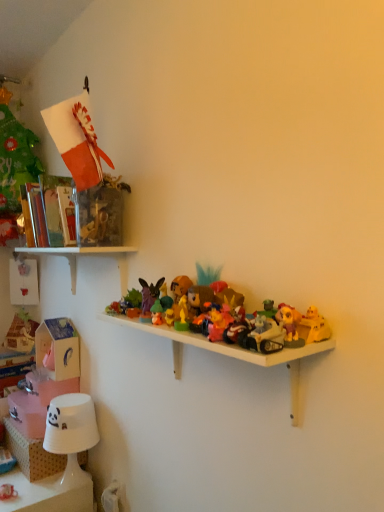
The width and height of the screenshot is (384, 512). Identify the location of green matte figurine at center, placed as the fourth toy when sorted from front to back. (157, 313).

Describe the element at coordinates (180, 286) in the screenshot. This screenshot has height=512, width=384. I see `shiny plastic figure at center, the fourth toy viewed from the left` at that location.

What is the approximate width of white plastic shelf at upper left, which appears as the 1th shelf when viewed from the top?

white plastic shelf at upper left, which appears as the 1th shelf when viewed from the top, is 8.12 inches wide.

The height and width of the screenshot is (512, 384). Find the location of `white glossy lampshade at lower left, the 3th shelf in the top-to-bottom sequence`. white glossy lampshade at lower left, the 3th shelf in the top-to-bottom sequence is located at coordinates (31, 454).

What's the angular difference between white glossy lampshade at lower left, the 3th shelf in the top-to-bottom sequence, and purple matte plush toy at center, placed as the second toy when sorted from left to right,'s facing directions?

They differ by 35.3 degrees in their facing directions.

Locate an element on the screen. toy that is the 1st one when counting rightward from the white glossy lampshade at lower left, the 3th shelf in the top-to-bottom sequence is located at coordinates (149, 294).

From a real-world perspective, is white glossy lampshade at lower left, positioned as the first shelf in bottom-to-top order, located beneath purple matte plush toy at center, arranged as the seventh toy when viewed from the right?

Yes, from a real-world perspective, white glossy lampshade at lower left, positioned as the first shelf in bottom-to-top order, is below purple matte plush toy at center, arranged as the seventh toy when viewed from the right.

Does white glossy lampshade at lower left, positioned as the first shelf in bottom-to-top order, have a smaller size compared to purple matte plush toy at center, which is the third toy from top to bottom?

No.

Consider the image. Can you tell me how much matte plastic toy at center, placed as the eighth toy when sorted from bottom to top, and white plastic shelf at center, the 2th shelf positioned from the top, differ in facing direction?

They differ by 0.00247 degrees in their facing directions.

From the image's perspective, is matte plastic toy at center, the fifth toy viewed from the left, above white plastic shelf at center, which is counted as the 2th shelf, starting from the bottom?

Indeed, from the image's perspective, matte plastic toy at center, the fifth toy viewed from the left, is shown above white plastic shelf at center, which is counted as the 2th shelf, starting from the bottom.

Can you confirm if matte plastic toy at center, the fourth toy in the right-to-left sequence, is taller than white plastic shelf at center, the 2th shelf positioned from the top?

Incorrect, the height of matte plastic toy at center, the fourth toy in the right-to-left sequence, is not larger of that of white plastic shelf at center, the 2th shelf positioned from the top.

From a real-world perspective, which is physically above, shiny plastic motorcycle at center, which is the 8th toy in back-to-front order, or white plastic shelf at upper left, which appears as the 1th shelf when viewed from the top?

From a 3D spatial view, white plastic shelf at upper left, which appears as the 1th shelf when viewed from the top, is above.

From the image's perspective, is shiny plastic motorcycle at center, marked as the seventh toy in a left-to-right arrangement, above or below white plastic shelf at upper left, marked as the 3th shelf in a bottom-to-top arrangement?

shiny plastic motorcycle at center, marked as the seventh toy in a left-to-right arrangement, is below white plastic shelf at upper left, marked as the 3th shelf in a bottom-to-top arrangement.

Is shiny plastic motorcycle at center, marked as the seventh toy in a left-to-right arrangement, located outside white plastic shelf at upper left, which appears as the 1th shelf when viewed from the top?

Yes, shiny plastic motorcycle at center, marked as the seventh toy in a left-to-right arrangement, is outside of white plastic shelf at upper left, which appears as the 1th shelf when viewed from the top.

Between white plastic shelf at center, which is counted as the 2th shelf, starting from the bottom, and matte plastic toy at center, the fourth toy in the right-to-left sequence, which one has less height?

With less height is matte plastic toy at center, the fourth toy in the right-to-left sequence.

Which object is thinner, white plastic shelf at center, the 2th shelf positioned from the top, or matte plastic toy at center, the fifth toy viewed from the left?

matte plastic toy at center, the fifth toy viewed from the left, is thinner.

From the image's perspective, is white plastic shelf at center, which is counted as the 2th shelf, starting from the bottom, positioned above or below matte plastic toy at center, arranged as the fourth toy when viewed from the back?

Clearly, from the image's perspective, white plastic shelf at center, which is counted as the 2th shelf, starting from the bottom, is below matte plastic toy at center, arranged as the fourth toy when viewed from the back.

Where is `the 7th toy located above the white plastic shelf at center, which is counted as the 2th shelf, starting from the bottom (from a real-world perspective)`? The image size is (384, 512). the 7th toy located above the white plastic shelf at center, which is counted as the 2th shelf, starting from the bottom (from a real-world perspective) is located at coordinates point(199,298).

Which object is wider, white plastic shelf at center, which is counted as the 2th shelf, starting from the bottom, or white plastic shelf at upper left, which appears as the 1th shelf when viewed from the top?

white plastic shelf at upper left, which appears as the 1th shelf when viewed from the top.

In the scene shown: Between white plastic shelf at center, the 2th shelf positioned from the top, and white plastic shelf at upper left, which appears as the 1th shelf when viewed from the top, which one appears on the right side from the viewer's perspective?

Positioned to the right is white plastic shelf at center, the 2th shelf positioned from the top.

Is white plastic shelf at center, the 2th shelf positioned from the top, far from white plastic shelf at upper left, marked as the 3th shelf in a bottom-to-top arrangement?

No, white plastic shelf at center, the 2th shelf positioned from the top, is not far from white plastic shelf at upper left, marked as the 3th shelf in a bottom-to-top arrangement.

Considering the relative positions of shiny plastic figure at center, positioned as the 6th toy in front-to-back order, and smooth white lampshade at lower left, the 1th toy positioned from the left, in the image provided, is shiny plastic figure at center, positioned as the 6th toy in front-to-back order, to the right of smooth white lampshade at lower left, the 1th toy positioned from the left, from the viewer's perspective?

Yes.

Is smooth white lampshade at lower left, which is counted as the eighth toy, starting from the front, at the back of shiny plastic figure at center, arranged as the third toy when viewed from the back?

No, shiny plastic figure at center, arranged as the third toy when viewed from the back,'s orientation is not away from smooth white lampshade at lower left, which is counted as the eighth toy, starting from the front.

Considering the sizes of shiny plastic figure at center, which is the fifth toy from right to left, and smooth white lampshade at lower left, the 1th toy when ordered from bottom to top, in the image, is shiny plastic figure at center, which is the fifth toy from right to left, bigger or smaller than smooth white lampshade at lower left, the 1th toy when ordered from bottom to top,?

Considering their sizes, shiny plastic figure at center, which is the fifth toy from right to left, takes up more space than smooth white lampshade at lower left, the 1th toy when ordered from bottom to top.

Is shiny plastic figure at center, arranged as the 7th toy when ordered from the bottom, positioned far away from smooth white lampshade at lower left, acting as the eighth toy starting from the right?

Actually, shiny plastic figure at center, arranged as the 7th toy when ordered from the bottom, and smooth white lampshade at lower left, acting as the eighth toy starting from the right, are a little close together.

Can you confirm if matte plastic toy at center, the fourth toy in the right-to-left sequence, is positioned to the left of shiny plastic motorcycle at center, which is counted as the sixth toy, starting from the top?

Yes.

Considering the sizes of objects matte plastic toy at center, the fifth toy viewed from the front, and shiny plastic motorcycle at center, marked as the seventh toy in a left-to-right arrangement, in the image provided, who is thinner, matte plastic toy at center, the fifth toy viewed from the front, or shiny plastic motorcycle at center, marked as the seventh toy in a left-to-right arrangement,?

matte plastic toy at center, the fifth toy viewed from the front, is thinner.

From the image's perspective, is matte plastic toy at center, the fifth toy viewed from the front, located above or below shiny plastic motorcycle at center, acting as the second toy starting from the right?

Based on their image positions, matte plastic toy at center, the fifth toy viewed from the front, is located above shiny plastic motorcycle at center, acting as the second toy starting from the right.

What's the angular difference between matte plastic toy at center, the fifth toy viewed from the front, and shiny plastic motorcycle at center, the first toy from the front,'s facing directions?

matte plastic toy at center, the fifth toy viewed from the front, and shiny plastic motorcycle at center, the first toy from the front, are facing 0.00106 degrees away from each other.

From the image's perspective, starting from the white glossy lampshade at lower left, positioned as the first shelf in bottom-to-top order, which toy is the 5th one above? Please provide its 2D coordinates.

[(149, 294)]

Find the location of a particular element. This screenshot has width=384, height=512. shelf that is the 1st one below the matte plastic toy at center, arranged as the fourth toy when viewed from the back (from a real-world perspective) is located at coordinates [x=232, y=353].

Looking at the image, which one is located closer to white glossy lampshade at lower left, the 3th shelf in the top-to-bottom sequence, shiny plastic toy at center right, which is the first toy from right to left, or green matte figurine at center, the 7th toy viewed from the top?

The object closer to white glossy lampshade at lower left, the 3th shelf in the top-to-bottom sequence, is green matte figurine at center, the 7th toy viewed from the top.

Which object lies nearer to the anchor point white plastic shelf at upper left, which appears as the 1th shelf when viewed from the top, green matte figurine at center, placed as the fourth toy when sorted from front to back, or matte plastic toy at center, the fifth toy viewed from the left?

green matte figurine at center, placed as the fourth toy when sorted from front to back, lies closer to white plastic shelf at upper left, which appears as the 1th shelf when viewed from the top, than the other object.

Based on their spatial positions, is matte plastic toy at center, arranged as the fourth toy when viewed from the back, or shiny plastic figure at center, arranged as the 7th toy when ordered from the bottom, further from smooth white lampshade at lower left, positioned as the eighth toy in top-to-bottom order?

matte plastic toy at center, arranged as the fourth toy when viewed from the back.

Looking at the image, which one is located closer to shiny plastic motorcycle at center, which is counted as the sixth toy, starting from the top, smooth white lampshade at lower left, the 1th toy when ordered from bottom to top, or shiny plastic toy at center right, the fifth toy from the bottom?

Among the two, shiny plastic toy at center right, the fifth toy from the bottom, is located nearer to shiny plastic motorcycle at center, which is counted as the sixth toy, starting from the top.

Which object lies nearer to the anchor point multicolored plastic toy at center, which is the 6th toy from left to right, shiny plastic toy at center right, which is the first toy from right to left, or white paper lampshade at lower left?

shiny plastic toy at center right, which is the first toy from right to left, is positioned closer to the anchor multicolored plastic toy at center, which is the 6th toy from left to right.

Looking at the image, which one is located closer to shiny plastic figure at center, arranged as the third toy when viewed from the back, matte plastic toy at center, arranged as the fourth toy when viewed from the back, or white plastic shelf at center, the 2th shelf positioned from the top?

matte plastic toy at center, arranged as the fourth toy when viewed from the back.

Looking at the image, which one is located further to smooth white lampshade at lower left, the 1th toy when ordered from bottom to top, white plastic shelf at upper left, which appears as the 1th shelf when viewed from the top, or white paper lampshade at lower left?

white plastic shelf at upper left, which appears as the 1th shelf when viewed from the top, is positioned further to the anchor smooth white lampshade at lower left, the 1th toy when ordered from bottom to top.

Estimate the real-world distances between objects in this image. Which object is further from white plastic shelf at center, which is counted as the 2th shelf, starting from the bottom, multicolored plastic toy at center, which is the third toy from front to back, or green matte figurine at center, placed as the fourth toy when sorted from front to back?

Among the two, green matte figurine at center, placed as the fourth toy when sorted from front to back, is located further to white plastic shelf at center, which is counted as the 2th shelf, starting from the bottom.

At what (x,y) coordinates should I click in order to perform the action: click on table lamp between purple matte plush toy at center, placed as the second toy when sorted from left to right, and white glossy lampshade at lower left, positioned as the first shelf in bottom-to-top order, in the up-down direction. Please return your answer as a coordinate pair (x, y). The image size is (384, 512). Looking at the image, I should click on (71, 433).

Where is `table lamp positioned between white plastic shelf at center, the 2th shelf positioned from the top, and white glossy lampshade at lower left, the 3th shelf in the top-to-bottom sequence, from near to far`? This screenshot has height=512, width=384. table lamp positioned between white plastic shelf at center, the 2th shelf positioned from the top, and white glossy lampshade at lower left, the 3th shelf in the top-to-bottom sequence, from near to far is located at coordinates (71, 433).

Where is `toy located between multicolored plastic toy at center, placed as the fifth toy when sorted from top to bottom, and shiny plastic toy at center right, which ranks as the 8th toy in left-to-right order, in the left-right direction`? toy located between multicolored plastic toy at center, placed as the fifth toy when sorted from top to bottom, and shiny plastic toy at center right, which ranks as the 8th toy in left-to-right order, in the left-right direction is located at coordinates (262, 335).

At what (x,y) coordinates should I click in order to perform the action: click on toy situated between white plastic shelf at upper left, marked as the 3th shelf in a bottom-to-top arrangement, and green matte figurine at center, marked as the 5th toy in a back-to-front arrangement, from left to right. Please return your answer as a coordinate pair (x, y). Looking at the image, I should click on (149, 294).